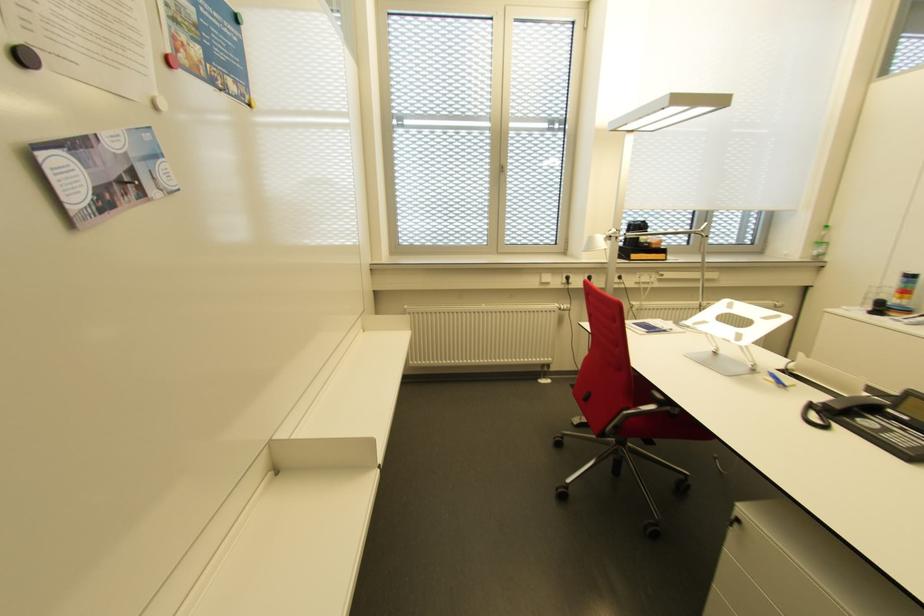
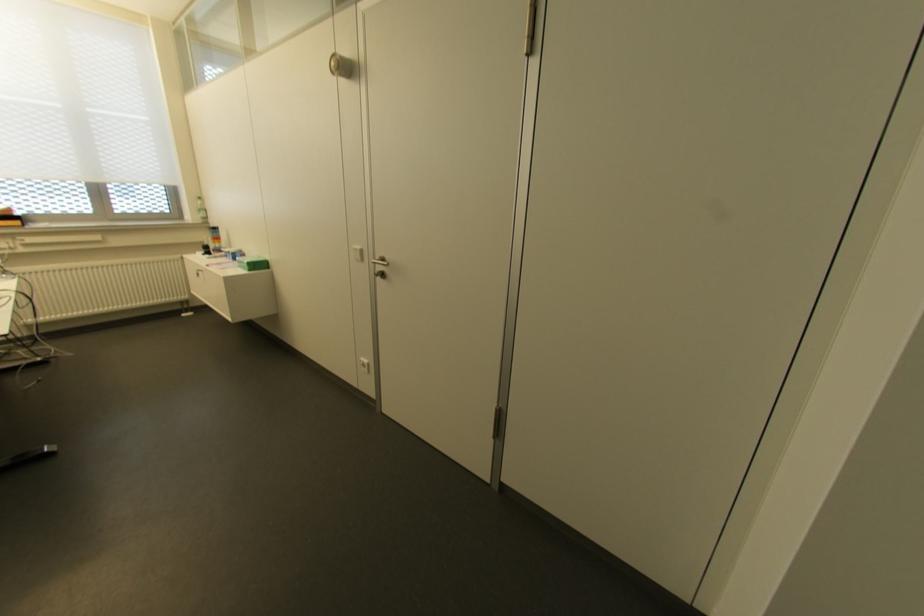
Find the pixel in the second image that matches [820,254] in the first image.

(204, 217)